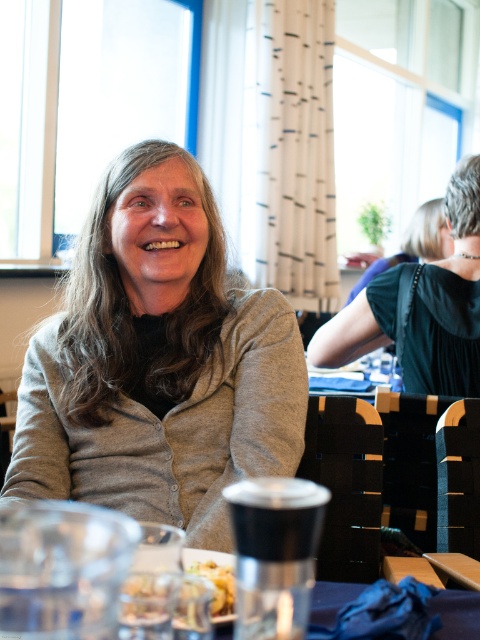
You are a fashion designer observing the scene. You need to note the exact position of the gray matte cardigan at center in the image. What are its coordinates?

The gray matte cardigan at center is located at coordinates point (157,364).

You are a fashion designer observing the scene and need to determine if the gray matte cardigan at center can be paired with the golden crumbly pastry at lower center in a photoshoot. Based on their sizes, is the cardigan large enough to cover the pastry?

The gray matte cardigan at center has a larger size compared to the golden crumbly pastry at lower center, so yes, the cardigan is large enough to cover the pastry.

You are a waiter in a restaurant and need to place a new order for a customer. The customer has a dark green dress at center and a golden crumbly pastry at lower center on their table. Can you safely place a small dessert plate between them without it touching either item?

The distance between the dark green dress at center and the golden crumbly pastry at lower center is 3.61 feet. Since the dessert plate is small, it can be placed between them without touching either item as there is sufficient space.